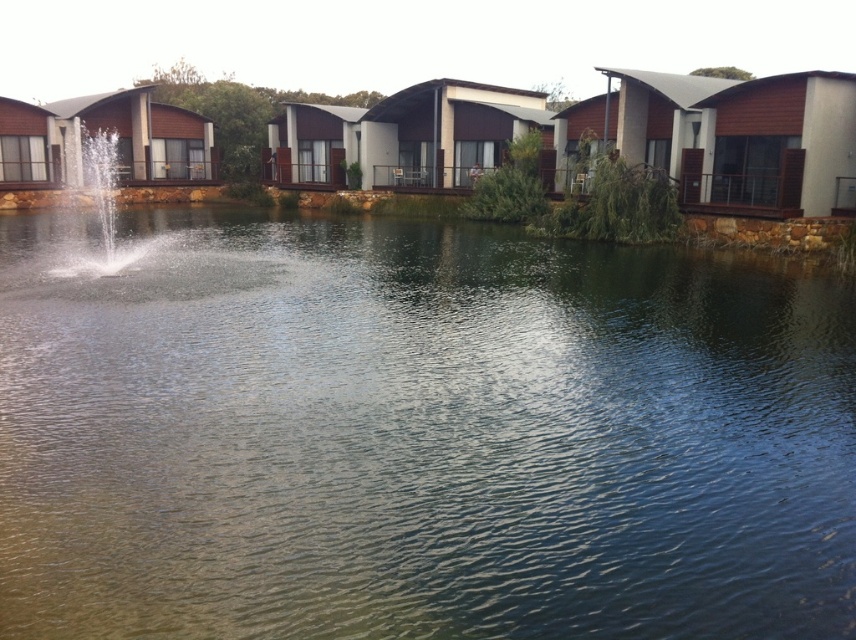
Does clear water at center have a lesser width compared to clear water fountain at center?

No.

Image resolution: width=856 pixels, height=640 pixels. In order to click on clear water at center in this screenshot , I will do `click(415, 435)`.

Find the location of `clear water at center`. clear water at center is located at coordinates (415, 435).